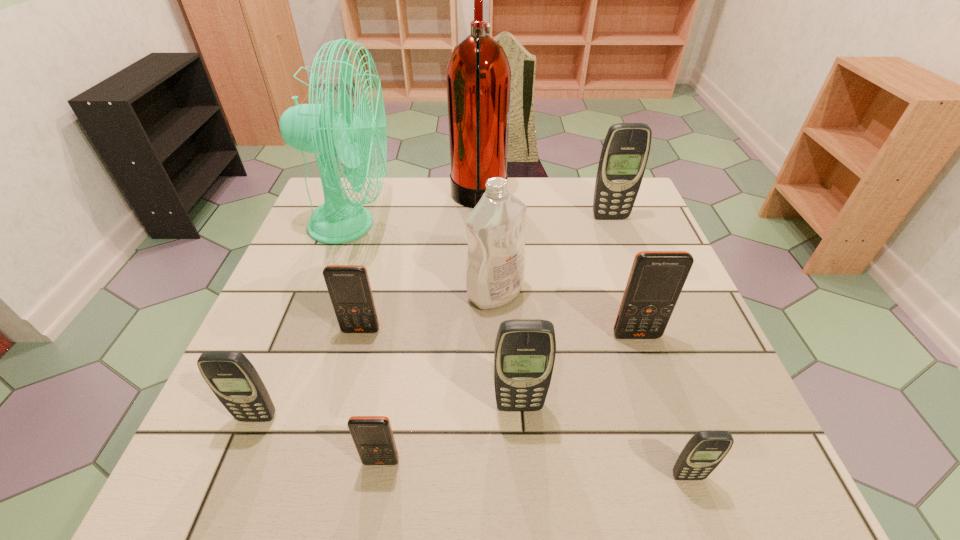
Where is `red fire extinguisher`? red fire extinguisher is located at coordinates (478, 77).

The width and height of the screenshot is (960, 540). Identify the location of blue fan. (315, 128).

Where is `white detergent`? This screenshot has width=960, height=540. white detergent is located at coordinates (495, 271).

Locate an element on the screen. detergent is located at coordinates (495, 271).

Find the location of a particular element. Image resolution: width=960 pixels, height=540 pixels. the farthest cellular telephone is located at coordinates (625, 151).

Locate an element on the screen. the biggest gray cellular telephone is located at coordinates (625, 151).

Where is `the biggest orange cellular telephone`? This screenshot has height=540, width=960. the biggest orange cellular telephone is located at coordinates (656, 279).

I want to click on the second biggest gray cellular telephone, so click(x=525, y=349).

This screenshot has width=960, height=540. I want to click on the fourth nearest object, so click(525, 349).

Image resolution: width=960 pixels, height=540 pixels. I want to click on the leftmost gray cellular telephone, so pyautogui.click(x=233, y=379).